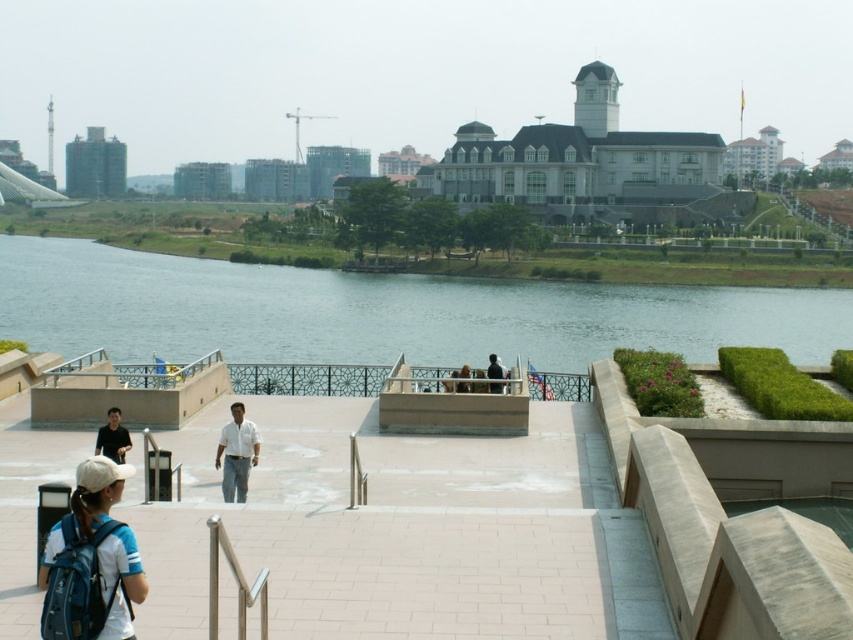
Question: Is black matte shirt at lower left further to camera compared to black matte jacket at center?

Choices:
 (A) no
 (B) yes

Answer: (A)

Question: Does blue fabric backpack at lower left appear under white matte shirt at center?

Choices:
 (A) yes
 (B) no

Answer: (B)

Question: Which object is the farthest from the light brown wooden bench at center?

Choices:
 (A) blue water at center
 (B) white matte shirt at center

Answer: (A)

Question: Can you confirm if black matte jacket at center is positioned to the right of light brown wooden bench at center?

Choices:
 (A) yes
 (B) no

Answer: (A)

Question: Which of these objects is positioned closest to the light brown wooden bench at center?

Choices:
 (A) black matte jacket at center
 (B) black matte shirt at lower left
 (C) blue water at center

Answer: (A)

Question: Considering the real-world distances, which object is farthest from the black matte shirt at lower left?

Choices:
 (A) blue water at center
 (B) light brown wooden bench at center

Answer: (A)